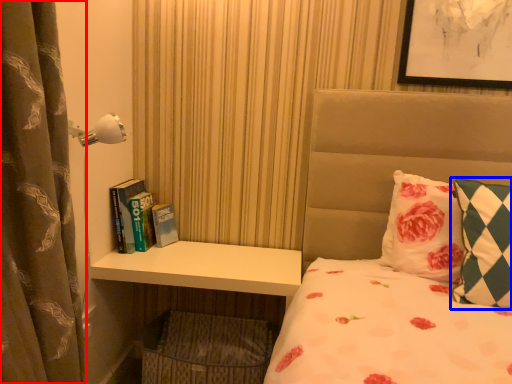
Question: Which of the following is the closest to the observer, curtain (highlighted by a red box) or pillow (highlighted by a blue box)?

Choices:
 (A) curtain
 (B) pillow

Answer: (A)